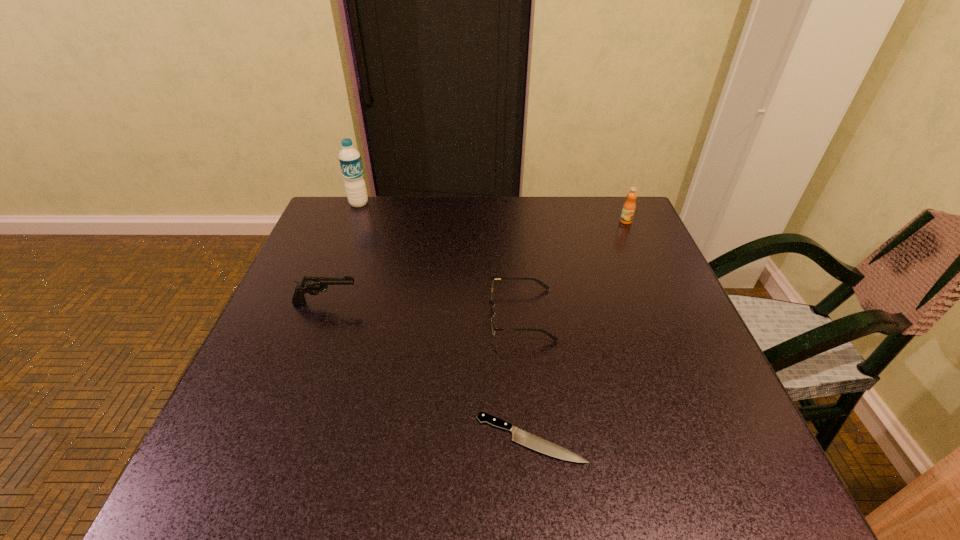
Where is `the closest object to the spectacles`? the closest object to the spectacles is located at coordinates (522, 437).

I want to click on vacant space that satisfies the following two spatial constraints: 1. on the back side of the steak knife; 2. at the end of the barrel of the third shortest object, so click(x=517, y=302).

Locate an element on the screen. This screenshot has width=960, height=540. free space that satisfies the following two spatial constraints: 1. on the back side of the steak knife; 2. at the end of the barrel of the third shortest object is located at coordinates (517, 302).

Where is `free location that satisfies the following two spatial constraints: 1. on the label of the tallest object; 2. on the left side of the shortest object`? This screenshot has height=540, width=960. free location that satisfies the following two spatial constraints: 1. on the label of the tallest object; 2. on the left side of the shortest object is located at coordinates (268, 438).

Locate an element on the screen. The width and height of the screenshot is (960, 540). free region that satisfies the following two spatial constraints: 1. on the front label of the rightmost object; 2. on the front-facing side of the fourth tallest object is located at coordinates (667, 314).